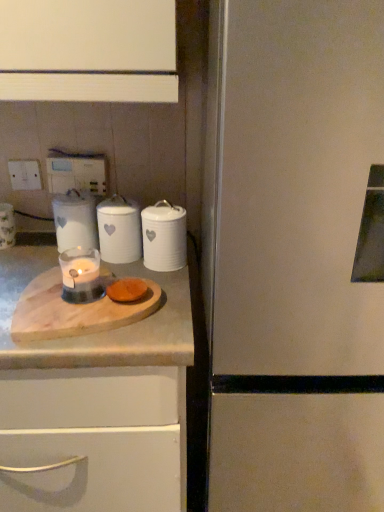
Where is `wooden cutting board at center, which is counted as the second countertop, starting from the bottom`? The image size is (384, 512). wooden cutting board at center, which is counted as the second countertop, starting from the bottom is located at coordinates (98, 332).

Describe the element at coordinates (164, 237) in the screenshot. This screenshot has height=512, width=384. I see `white ceramic canister at center, the first kitchen appliance when ordered from right to left` at that location.

Where is `white plastic electric outlet at upper left, the first electric outlet from the left`? The width and height of the screenshot is (384, 512). white plastic electric outlet at upper left, the first electric outlet from the left is located at coordinates (25, 175).

At what (x,y) coordinates should I click in order to perform the action: click on wooden cutting board at center, arranged as the first countertop when ordered from the bottom. Please return your answer as a coordinate pair (x, y). Looking at the image, I should click on (96, 357).

The width and height of the screenshot is (384, 512). What do you see at coordinates (119, 230) in the screenshot?
I see `white ceramic canister at center, the second kitchen appliance viewed from the right` at bounding box center [119, 230].

What is the approximate height of white plastic electric outlet at upper left, placed as the 1th electric outlet when sorted from right to left?

The height of white plastic electric outlet at upper left, placed as the 1th electric outlet when sorted from right to left, is 4.32 inches.

Where is `wooden cutting board at center, which is counted as the second countertop, starting from the bottom`? The height and width of the screenshot is (512, 384). wooden cutting board at center, which is counted as the second countertop, starting from the bottom is located at coordinates (98, 332).

Can you confirm if white ceramic canister at center, the first kitchen appliance when ordered from right to left, is thinner than white ceramic canister at center, the second kitchen appliance viewed from the right?

Indeed, white ceramic canister at center, the first kitchen appliance when ordered from right to left, has a lesser width compared to white ceramic canister at center, the second kitchen appliance viewed from the right.

From a real-world perspective, who is located lower, white ceramic canister at center, which is counted as the third kitchen appliance, starting from the left, or white ceramic canister at center, which appears as the 2th kitchen appliance when viewed from the left?

From a 3D spatial view, white ceramic canister at center, which appears as the 2th kitchen appliance when viewed from the left, is below.

Is white ceramic canister at center, the second kitchen appliance viewed from the right, at the back of white ceramic canister at center, the first kitchen appliance when ordered from right to left?

No, white ceramic canister at center, the first kitchen appliance when ordered from right to left,'s orientation is not away from white ceramic canister at center, the second kitchen appliance viewed from the right.

Does white ceramic candle at center, the third kitchen appliance when ordered from right to left, lie behind translucent glass candle at center?

Yes, it is.

Would you say white ceramic candle at center, which is the 1th kitchen appliance from left to right, contains translucent glass candle at center?

No, white ceramic candle at center, which is the 1th kitchen appliance from left to right, does not contain translucent glass candle at center.

In the scene shown: Can you tell me how much white ceramic candle at center, the third kitchen appliance when ordered from right to left, and translucent glass candle at center differ in facing direction?

51.3 degrees separate the facing orientations of white ceramic candle at center, the third kitchen appliance when ordered from right to left, and translucent glass candle at center.

How much distance is there between white ceramic candle at center, which is the 1th kitchen appliance from left to right, and translucent glass candle at center?

The distance of white ceramic candle at center, which is the 1th kitchen appliance from left to right, from translucent glass candle at center is 5.14 inches.

Between white ceramic candle at center, which is the 1th kitchen appliance from left to right, and white plastic electric outlet at upper left, placed as the 1th electric outlet when sorted from right to left, which one has more height?

white ceramic candle at center, which is the 1th kitchen appliance from left to right, is taller.

Is white ceramic candle at center, which is the 1th kitchen appliance from left to right, to the left or to the right of white plastic electric outlet at upper left, which appears as the second electric outlet when viewed from the left, in the image?

In the image, white ceramic candle at center, which is the 1th kitchen appliance from left to right, appears on the right side of white plastic electric outlet at upper left, which appears as the second electric outlet when viewed from the left.

Relative to white plastic electric outlet at upper left, placed as the 1th electric outlet when sorted from right to left, is white ceramic candle at center, which is the 1th kitchen appliance from left to right, in front or behind?

Clearly, white ceramic candle at center, which is the 1th kitchen appliance from left to right, is in front of white plastic electric outlet at upper left, placed as the 1th electric outlet when sorted from right to left.

Could you tell me if white ceramic canister at center, which is counted as the third kitchen appliance, starting from the left, is facing satin white refrigerator at right?

No, white ceramic canister at center, which is counted as the third kitchen appliance, starting from the left, does not turn towards satin white refrigerator at right.

Does point (180, 222) come behind point (252, 439)?

Yes, it is behind point (252, 439).

Is white ceramic canister at center, which is counted as the third kitchen appliance, starting from the left, positioned beyond the bounds of satin white refrigerator at right?

Yes, white ceramic canister at center, which is counted as the third kitchen appliance, starting from the left, is not within satin white refrigerator at right.

In terms of width, does white ceramic canister at center, the first kitchen appliance when ordered from right to left, look wider or thinner when compared to satin white refrigerator at right?

In the image, white ceramic canister at center, the first kitchen appliance when ordered from right to left, appears to be more narrow than satin white refrigerator at right.

Who is shorter, white ceramic candle at center, which is the 1th kitchen appliance from left to right, or white ceramic canister at center, which is counted as the third kitchen appliance, starting from the left?

white ceramic canister at center, which is counted as the third kitchen appliance, starting from the left, is shorter.

Does white ceramic candle at center, the third kitchen appliance when ordered from right to left, appear on the left side of white ceramic canister at center, the first kitchen appliance when ordered from right to left?

Yes.

From the picture: Considering the relative sizes of white ceramic candle at center, the third kitchen appliance when ordered from right to left, and white ceramic canister at center, the first kitchen appliance when ordered from right to left, in the image provided, is white ceramic candle at center, the third kitchen appliance when ordered from right to left, bigger than white ceramic canister at center, the first kitchen appliance when ordered from right to left,?

Yes, white ceramic candle at center, the third kitchen appliance when ordered from right to left, is bigger than white ceramic canister at center, the first kitchen appliance when ordered from right to left.

Would you say white ceramic candle at center, the third kitchen appliance when ordered from right to left, is inside or outside white ceramic canister at center, the first kitchen appliance when ordered from right to left?

The correct answer is: outside.

Identify the location of kitchen appliance that is the 3rd object located in front of the white plastic electric outlet at upper left, placed as the 1th electric outlet when sorted from right to left. The height and width of the screenshot is (512, 384). (164, 237).

Is white ceramic canister at center, the first kitchen appliance when ordered from right to left, at the right side of white plastic electric outlet at upper left, which appears as the second electric outlet when viewed from the left?

Yes.

Is white ceramic canister at center, which is counted as the third kitchen appliance, starting from the left, shorter than white plastic electric outlet at upper left, placed as the 1th electric outlet when sorted from right to left?

In fact, white ceramic canister at center, which is counted as the third kitchen appliance, starting from the left, may be taller than white plastic electric outlet at upper left, placed as the 1th electric outlet when sorted from right to left.

Is white plastic electric outlet at upper left, placed as the 1th electric outlet when sorted from right to left, facing away from white plastic electric outlet at upper left, which is the 2th electric outlet from right to left?

No.

Which is in front, point (101, 181) or point (14, 175)?

The point (101, 181) is closer.

Can we say white plastic electric outlet at upper left, which appears as the second electric outlet when viewed from the left, lies outside white plastic electric outlet at upper left, which is the 2th electric outlet from right to left?

Yes.

Is white plastic electric outlet at upper left, placed as the 1th electric outlet when sorted from right to left, not close to white plastic electric outlet at upper left, the first electric outlet from the left?

That's not correct — white plastic electric outlet at upper left, placed as the 1th electric outlet when sorted from right to left, is a little close to white plastic electric outlet at upper left, the first electric outlet from the left.

At what (x,y) coordinates should I click in order to perform the action: click on the 1st kitchen appliance positioned above the white ceramic canister at center, the second kitchen appliance viewed from the right (from a real-world perspective). Please return your answer as a coordinate pair (x, y). Image resolution: width=384 pixels, height=512 pixels. Looking at the image, I should click on (164, 237).

Identify the location of the 3rd kitchen appliance behind the translucent glass candle at center. This screenshot has height=512, width=384. (75, 220).

Estimate the real-world distances between objects in this image. Which object is further from satin white refrigerator at right, white ceramic candle at center, which is the 1th kitchen appliance from left to right, or white ceramic canister at center, which appears as the 2th kitchen appliance when viewed from the left?

white ceramic candle at center, which is the 1th kitchen appliance from left to right, is positioned further to the anchor satin white refrigerator at right.

Which object lies further to the anchor point white ceramic canister at center, the first kitchen appliance when ordered from right to left, white plastic electric outlet at upper left, which appears as the second electric outlet when viewed from the left, or wooden cutting board at center, arranged as the first countertop when ordered from the bottom?

white plastic electric outlet at upper left, which appears as the second electric outlet when viewed from the left.

Estimate the real-world distances between objects in this image. Which object is closer to white plastic electric outlet at upper left, placed as the 1th electric outlet when sorted from right to left, white plastic electric outlet at upper left, the first electric outlet from the left, or wooden cutting board at center, the second countertop positioned from the top?

Based on the image, white plastic electric outlet at upper left, the first electric outlet from the left, appears to be nearer to white plastic electric outlet at upper left, placed as the 1th electric outlet when sorted from right to left.

Considering their positions, is wooden cutting board at center, which is counted as the second countertop, starting from the bottom, positioned further to white plastic electric outlet at upper left, the first electric outlet from the left, than white ceramic canister at center, which appears as the 2th kitchen appliance when viewed from the left?

wooden cutting board at center, which is counted as the second countertop, starting from the bottom, lies further to white plastic electric outlet at upper left, the first electric outlet from the left, than the other object.

When comparing their distances from satin white refrigerator at right, does white ceramic canister at center, the first kitchen appliance when ordered from right to left, or white ceramic candle at center, which is the 1th kitchen appliance from left to right, seem further?

Based on the image, white ceramic candle at center, which is the 1th kitchen appliance from left to right, appears to be further to satin white refrigerator at right.

Which object lies further to the anchor point white ceramic candle at center, the third kitchen appliance when ordered from right to left, white plastic electric outlet at upper left, which is the 2th electric outlet from right to left, or wooden cutting board at center, arranged as the first countertop when ordered from the bottom?

wooden cutting board at center, arranged as the first countertop when ordered from the bottom, lies further to white ceramic candle at center, the third kitchen appliance when ordered from right to left, than the other object.

From the image, which object appears to be farther from wooden cutting board at center, arranged as the first countertop when ordered from the bottom, white ceramic candle at center, which is the 1th kitchen appliance from left to right, or white ceramic canister at center, which is counted as the third kitchen appliance, starting from the left?

The object further to wooden cutting board at center, arranged as the first countertop when ordered from the bottom, is white ceramic candle at center, which is the 1th kitchen appliance from left to right.

Estimate the real-world distances between objects in this image. Which object is further from white ceramic candle at center, the third kitchen appliance when ordered from right to left, satin white refrigerator at right or wooden cutting board at center, which is counted as the second countertop, starting from the bottom?

satin white refrigerator at right is positioned further to the anchor white ceramic candle at center, the third kitchen appliance when ordered from right to left.

This screenshot has height=512, width=384. I want to click on candle holder situated between wooden cutting board at center, the first countertop from the top, and satin white refrigerator at right from left to right, so click(81, 275).

At what (x,y) coordinates should I click in order to perform the action: click on countertop between translucent glass candle at center and wooden cutting board at center, arranged as the first countertop when ordered from the bottom, in the vertical direction. Please return your answer as a coordinate pair (x, y). This screenshot has height=512, width=384. Looking at the image, I should click on (98, 332).

Locate an element on the screen. This screenshot has height=512, width=384. countertop between white ceramic candle at center, which is the 1th kitchen appliance from left to right, and wooden cutting board at center, the second countertop positioned from the top, from top to bottom is located at coordinates (98, 332).

In order to click on countertop between white ceramic canister at center, which is counted as the third kitchen appliance, starting from the left, and wooden cutting board at center, arranged as the first countertop when ordered from the bottom, in the vertical direction in this screenshot , I will do `click(98, 332)`.